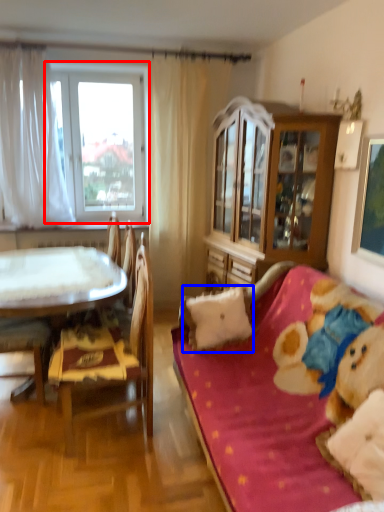
Question: Which point is further to the camera, window (highlighted by a red box) or pillow (highlighted by a blue box)?

Choices:
 (A) window
 (B) pillow

Answer: (A)